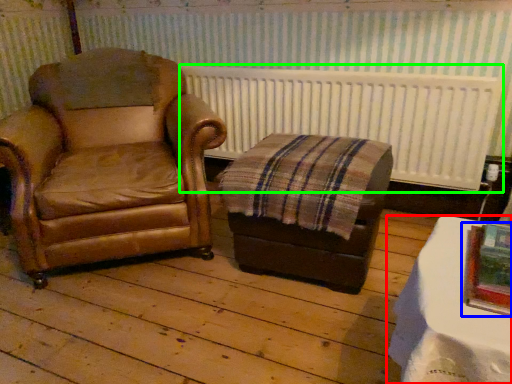
Question: Which is farther away from table (highlighted by a red box)? picture frame (highlighted by a blue box) or radiator (highlighted by a green box)?

Choices:
 (A) picture frame
 (B) radiator

Answer: (B)